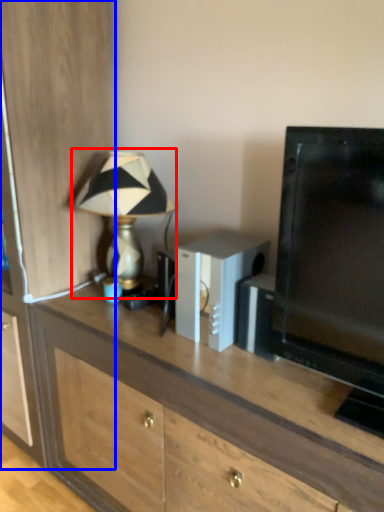
Question: Which point is closer to the camera, lamp (highlighted by a red box) or cabinetry (highlighted by a blue box)?

Choices:
 (A) lamp
 (B) cabinetry

Answer: (B)